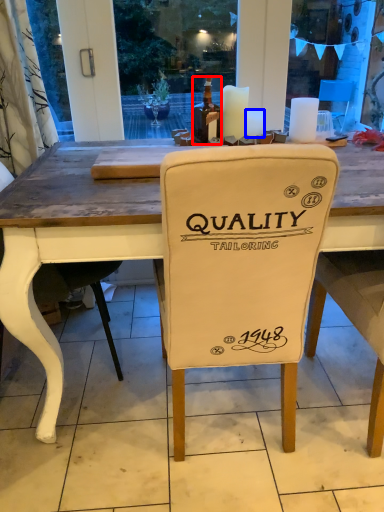
Question: Which object appears farthest to the camera in this image, bottle (highlighted by a red box) or candle (highlighted by a blue box)?

Choices:
 (A) bottle
 (B) candle

Answer: (B)